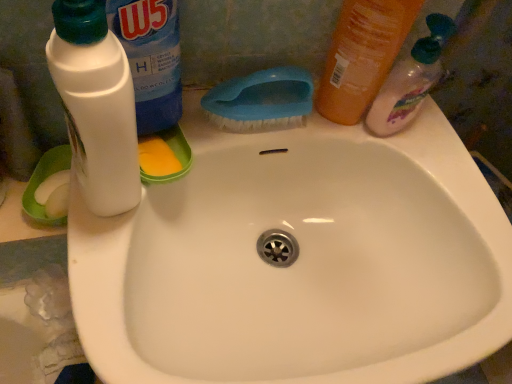
Question: Should I look upward or downward to see blue plastic brush at upper center?

Choices:
 (A) up
 (B) down

Answer: (A)

Question: From a real-world perspective, is blue plastic brush at upper center positioned under white plastic bottle at upper left, the 1th cleaning product from the left, based on gravity?

Choices:
 (A) yes
 (B) no

Answer: (A)

Question: Is blue plastic brush at upper center to the right of white plastic bottle at upper left, the 1th cleaning product from the left, from the viewer's perspective?

Choices:
 (A) yes
 (B) no

Answer: (A)

Question: Is blue plastic brush at upper center in front of white plastic bottle at upper left, the 1th cleaning product from the left?

Choices:
 (A) yes
 (B) no

Answer: (B)

Question: Is blue plastic brush at upper center smaller than white plastic bottle at upper left, the 3th cleaning product viewed from the right?

Choices:
 (A) yes
 (B) no

Answer: (A)

Question: Does blue plastic brush at upper center appear on the left side of white plastic bottle at upper left, the 1th cleaning product from the left?

Choices:
 (A) no
 (B) yes

Answer: (A)

Question: Can you confirm if blue plastic brush at upper center is wider than white plastic bottle at upper left, the 3th cleaning product viewed from the right?

Choices:
 (A) no
 (B) yes

Answer: (A)

Question: Does white matte bottle at left have a lesser height compared to white plastic bottle at upper left, the 3th cleaning product viewed from the right?

Choices:
 (A) yes
 (B) no

Answer: (A)

Question: Can you confirm if white matte bottle at left is smaller than white plastic bottle at upper left, the 1th cleaning product from the left?

Choices:
 (A) yes
 (B) no

Answer: (A)

Question: Could you tell me if white matte bottle at left is facing white plastic bottle at upper left, the 3th cleaning product viewed from the right?

Choices:
 (A) yes
 (B) no

Answer: (B)

Question: From the image's perspective, would you say white matte bottle at left is positioned over white plastic bottle at upper left, the 3th cleaning product viewed from the right?

Choices:
 (A) yes
 (B) no

Answer: (B)

Question: Considering the relative positions of white matte bottle at left and white plastic bottle at upper left, the 3th cleaning product viewed from the right, in the image provided, is white matte bottle at left to the right of white plastic bottle at upper left, the 3th cleaning product viewed from the right, from the viewer's perspective?

Choices:
 (A) no
 (B) yes

Answer: (A)

Question: Is white matte bottle at left further to camera compared to white plastic bottle at upper left, the 1th cleaning product from the left?

Choices:
 (A) no
 (B) yes

Answer: (A)

Question: Is white plastic bottle at upper left, the 1th cleaning product from the left, thinner than translucent plastic bottle at upper right, the 2th cleaning product from the left?

Choices:
 (A) yes
 (B) no

Answer: (B)